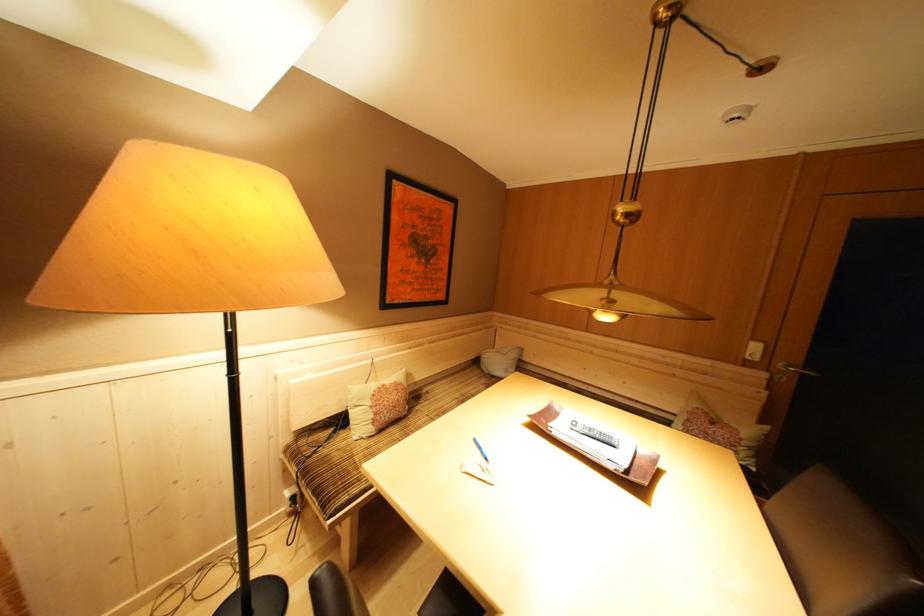
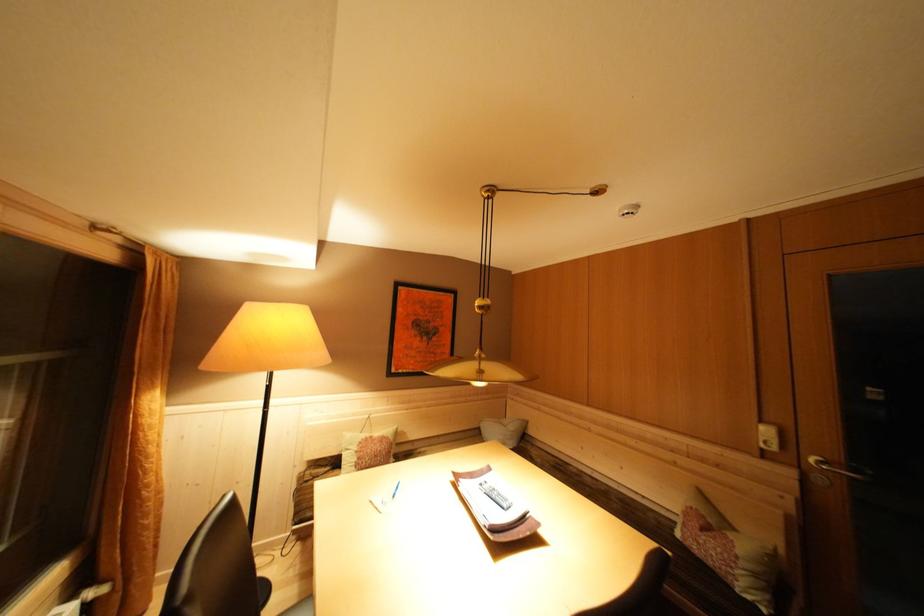
Where in the second image is the point corresponding to the point at 759,344 from the first image?

(768, 427)